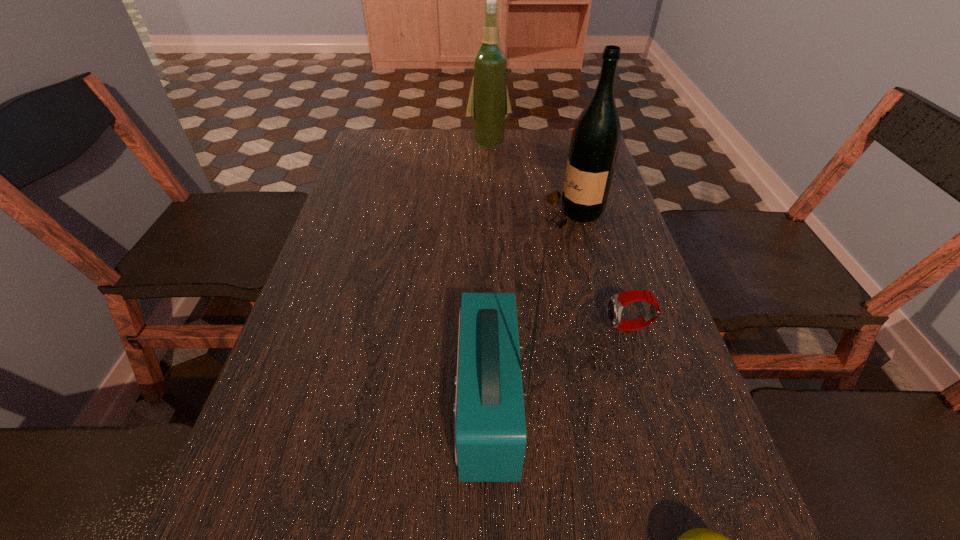
The image size is (960, 540). In order to click on free space located on the front panel of the second nearest object in this screenshot , I will do `click(327, 406)`.

Identify the location of free spot located 0.250m on the front panel of the second nearest object. (310, 406).

This screenshot has width=960, height=540. Identify the location of vacant space situated on the front panel of the second nearest object. (304, 406).

The width and height of the screenshot is (960, 540). Identify the location of free space located 0.310m on the face of the third farthest object. pyautogui.click(x=452, y=327).

Locate an element on the screen. free location located 0.320m on the face of the third farthest object is located at coordinates (446, 327).

Image resolution: width=960 pixels, height=540 pixels. Identify the location of free space located on the face of the third farthest object. (516, 327).

Image resolution: width=960 pixels, height=540 pixels. In order to click on object at the far edge in this screenshot , I will do `click(488, 106)`.

You are a GUI agent. You are given a task and a screenshot of the screen. Output one action in this format:
    pyautogui.click(x=<x>, y=<y>)
    Task: Click on the wine bottle located in the right edge section of the desktop
    
    Given the screenshot: What is the action you would take?
    pyautogui.click(x=595, y=140)

Locate an element on the screen. The width and height of the screenshot is (960, 540). watch positioned at the right edge is located at coordinates (616, 303).

Image resolution: width=960 pixels, height=540 pixels. Identify the location of vacant space at the far edge of the desktop. (537, 141).